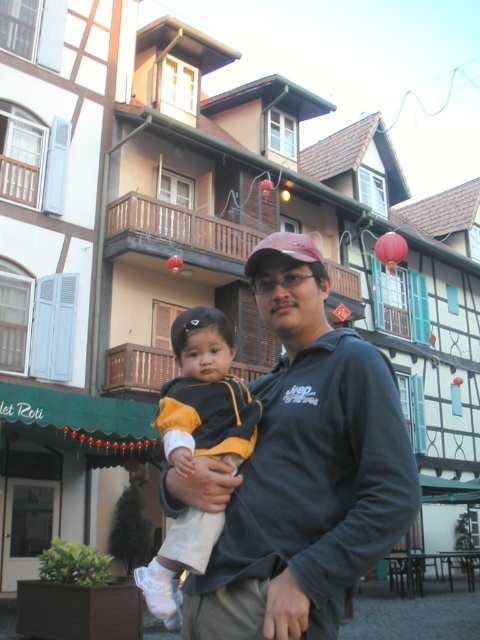
Is point (146, 586) positioned before point (260, 243)?

Yes, point (146, 586) is in front of point (260, 243).

Image resolution: width=480 pixels, height=640 pixels. I want to click on yellow and black jacket at center, so click(204, 396).

Locate an element on the screen. The width and height of the screenshot is (480, 640). yellow and black jacket at center is located at coordinates (204, 396).

Who is more forward, (244, 488) or (288, 243)?

Point (244, 488) is in front.

In the scene shown: Is dark gray sweatshirt at center below matte pink baseball cap at center?

Yes.

Which is behind, point (323, 579) or point (261, 241)?

Positioned behind is point (261, 241).

The height and width of the screenshot is (640, 480). I want to click on dark gray sweatshirt at center, so click(301, 477).

Which of these two, dark gray sweatshirt at center or yellow and black jacket at center, stands shorter?

dark gray sweatshirt at center is shorter.

Who is taller, dark gray sweatshirt at center or yellow and black jacket at center?

yellow and black jacket at center

This screenshot has width=480, height=640. Find the location of `dark gray sweatshirt at center`. dark gray sweatshirt at center is located at coordinates (301, 477).